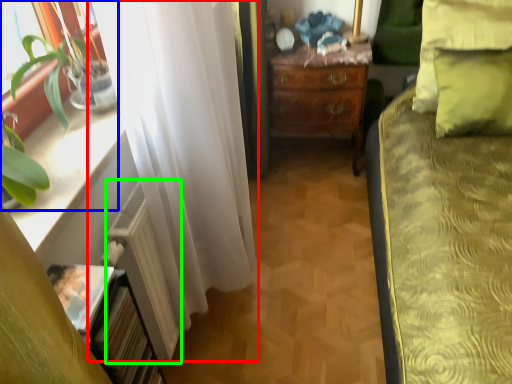
Question: Estimate the real-world distances between objects in this image. Which object is farther from curtain (highlighted by a red box), houseplant (highlighted by a blue box) or radiator (highlighted by a green box)?

Choices:
 (A) houseplant
 (B) radiator

Answer: (A)